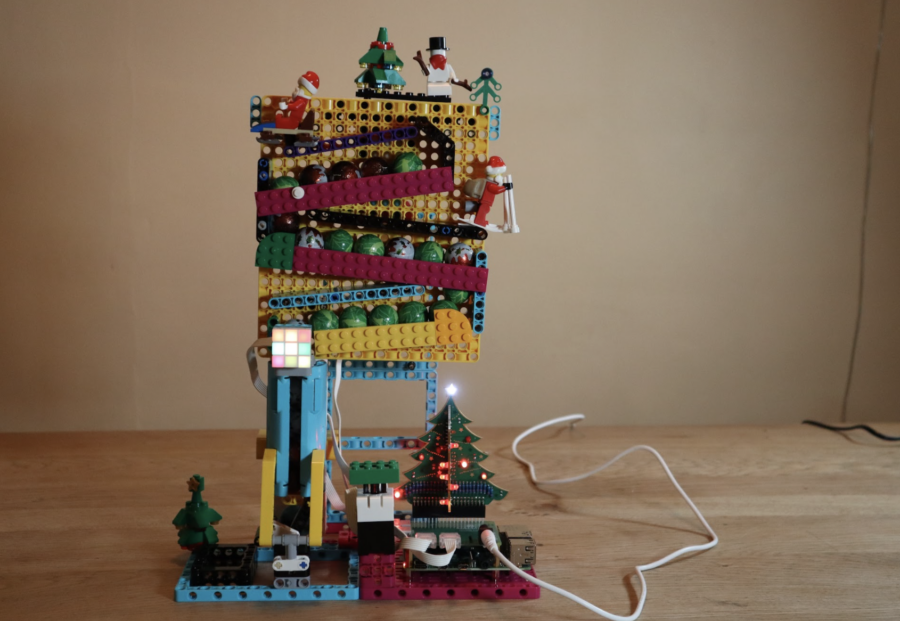
The height and width of the screenshot is (621, 900). What are the coordinates of `lego christmas trees` in the screenshot? It's located at (457, 469), (392, 57), (488, 92), (199, 528).